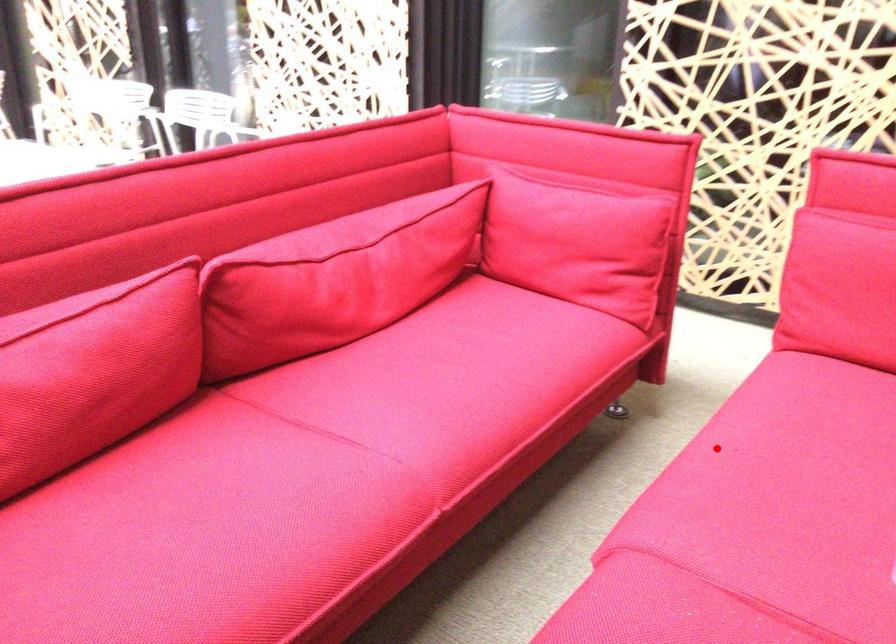
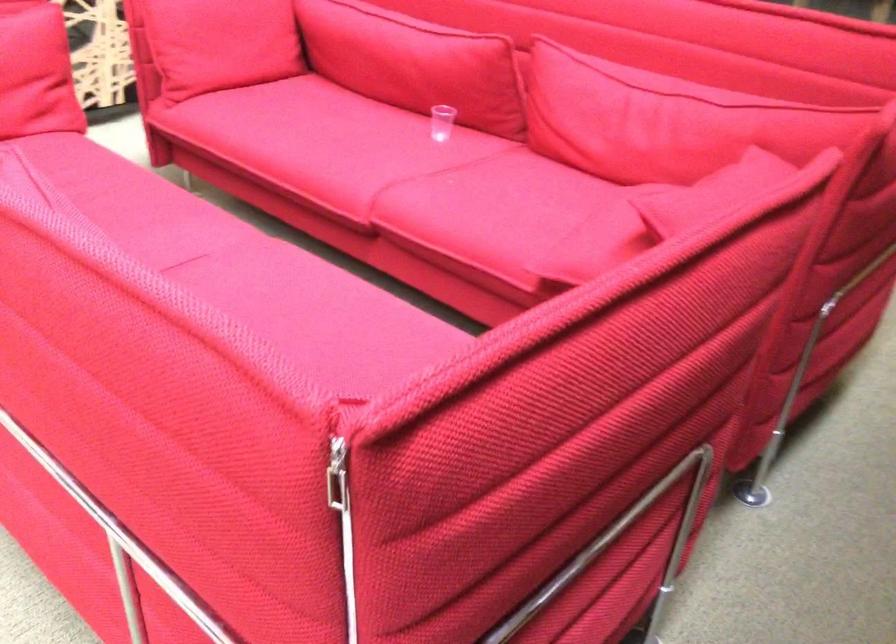
Locate, in the second image, the point that corresponds to the highlighted location in the first image.

(320, 146)